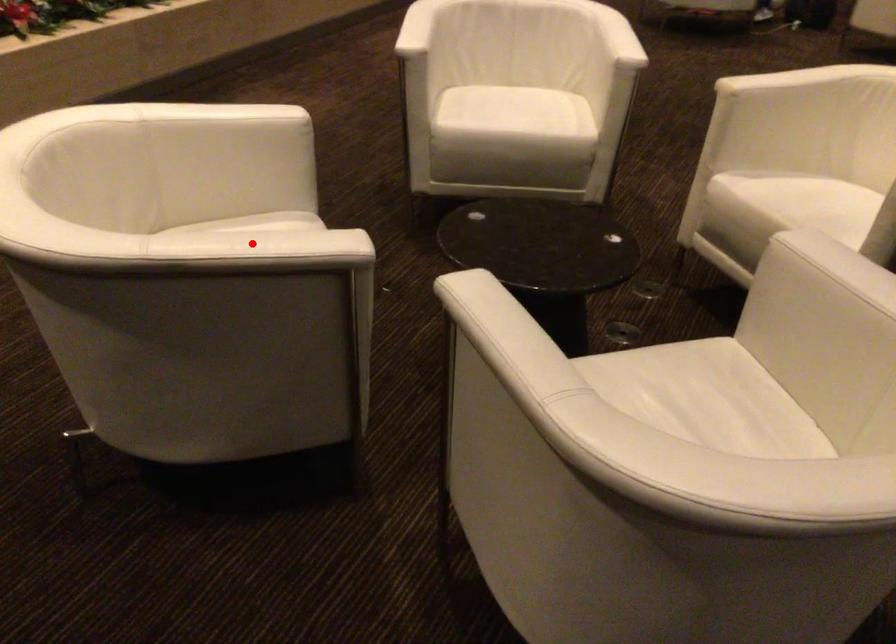
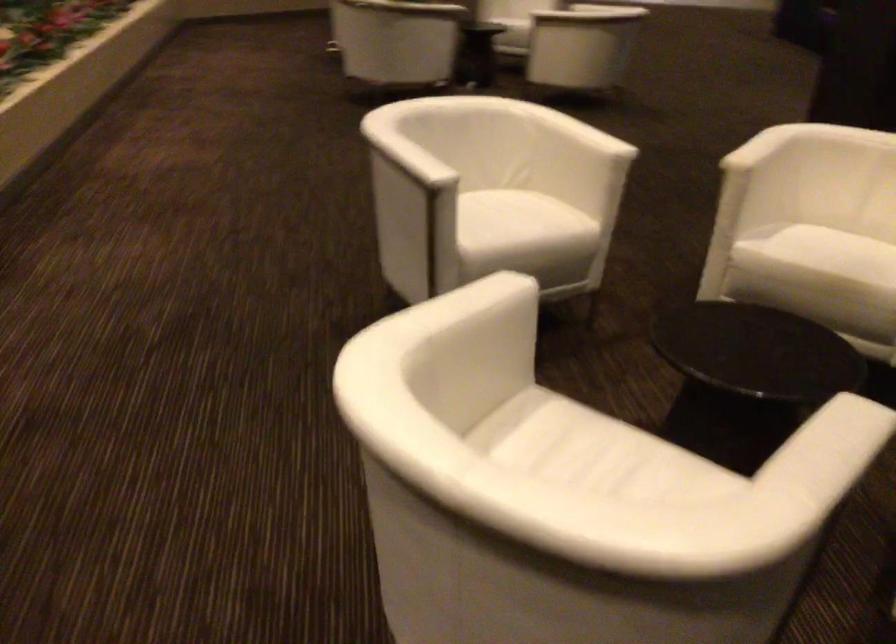
In the second image, find the point that corresponds to the highlighted location in the first image.

(839, 446)